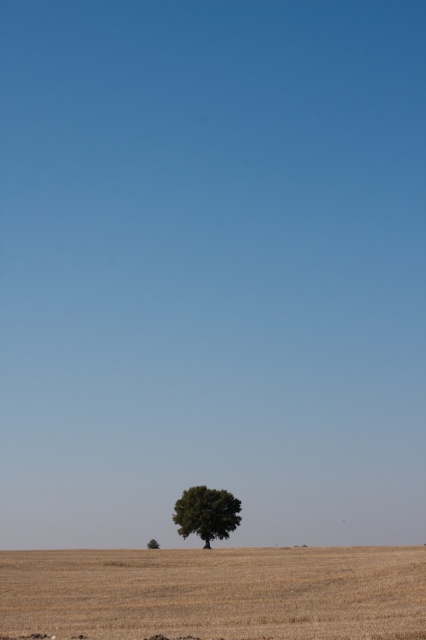
You are a drone operator flying a drone that must avoid obstacles. You are instructed to fly your drone from the edge of the field directly towards the center of the sky. However, there is a green leafy tree at center in your flight path. According to the coordinates provided, will the drone collide with the tree?

The green leafy tree at center is located at coordinates (207, 513). Since the drone is flying towards the center of the sky, which is at coordinates (213, 320), the flight path would not align with the tree, so the drone will not collide with the tree.

You are a farmer looking at the image of your field. You notice the brown dry grass at lower center and the green leafy tree at lower center. Which one is higher in the image?

The brown dry grass at lower center is above the green leafy tree at lower center in the image.